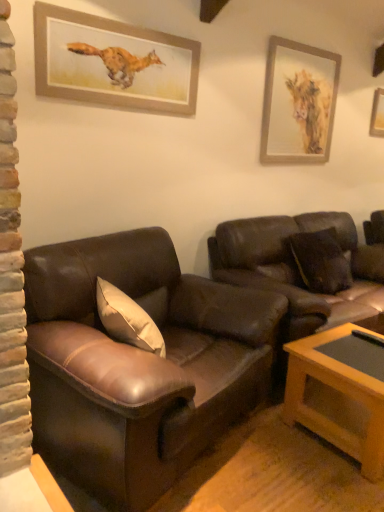
This screenshot has width=384, height=512. Find the location of `free space above matte gold picture frame at upper right, which is the 2th picture frame from front to back (from a real-world perspective)`. free space above matte gold picture frame at upper right, which is the 2th picture frame from front to back (from a real-world perspective) is located at coordinates (308, 40).